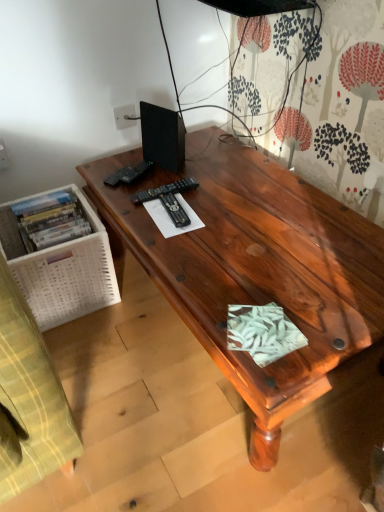
Locate an element on the screen. free space to the back side of black plastic remote control at center, the 2th remote control viewed from the back is located at coordinates (178, 169).